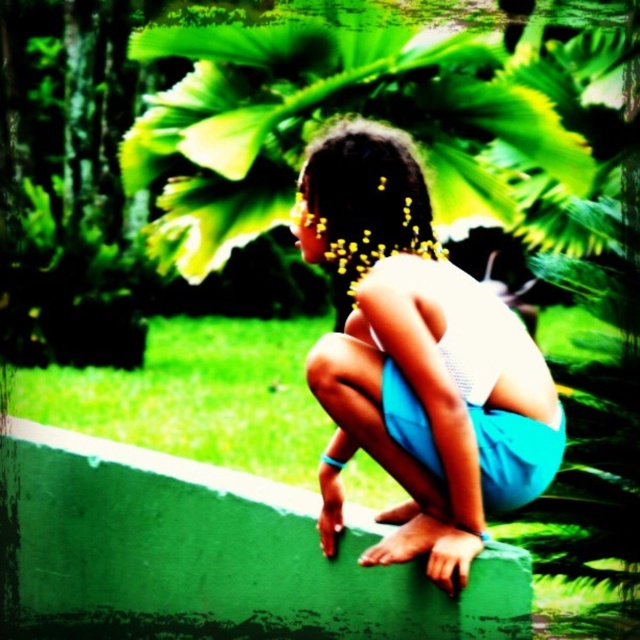
Question: Which object appears farthest from the camera in this image?

Choices:
 (A) white matte shorts at center
 (B) dark brown hair at center

Answer: (B)

Question: Which object appears closest to the camera in this image?

Choices:
 (A) dark brown hair at center
 (B) white matte shorts at center

Answer: (B)

Question: Can you confirm if white matte shorts at center is bigger than dark brown hair at center?

Choices:
 (A) yes
 (B) no

Answer: (A)

Question: Is white matte shorts at center bigger than dark brown hair at center?

Choices:
 (A) no
 (B) yes

Answer: (B)

Question: Which object is farther from the camera taking this photo?

Choices:
 (A) white matte shorts at center
 (B) dark brown hair at center

Answer: (B)

Question: Does white matte shorts at center lie behind dark brown hair at center?

Choices:
 (A) no
 (B) yes

Answer: (A)